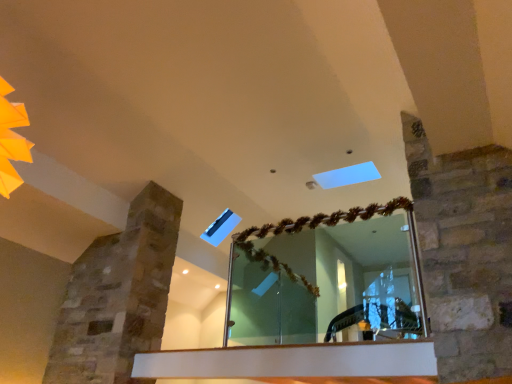
Identify the location of clear glass mirror at center. (327, 278).

The width and height of the screenshot is (512, 384). What do you see at coordinates (327, 278) in the screenshot?
I see `clear glass mirror at center` at bounding box center [327, 278].

Where is `clear glass mirror at center`? This screenshot has height=384, width=512. clear glass mirror at center is located at coordinates (327, 278).